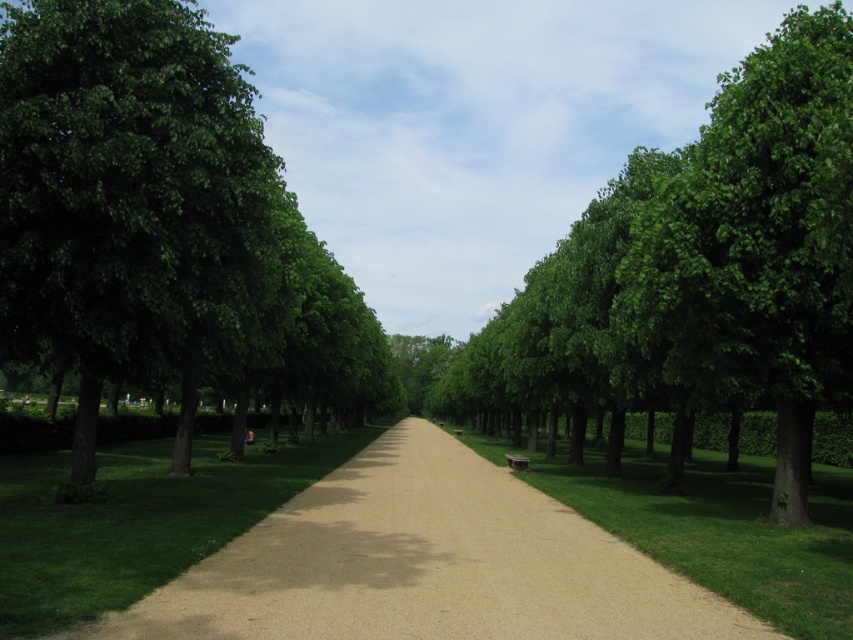
Question: Which object is the closest to the green grass at center?

Choices:
 (A) brown gravel path at center
 (B) green grass at left

Answer: (A)

Question: Can you confirm if green leafy tree at left is positioned to the left of green grass at center?

Choices:
 (A) yes
 (B) no

Answer: (A)

Question: Among these points, which one is nearest to the camera?

Choices:
 (A) (73, 576)
 (B) (236, 300)
 (C) (784, 404)
 (D) (822, 531)

Answer: (A)

Question: Which of the following is the farthest from the observer?

Choices:
 (A) green leafy tree at center
 (B) green grass at center
 (C) green leafy tree at left
 (D) green grass at left

Answer: (C)

Question: Does brown gravel path at center have a lesser width compared to green grass at left?

Choices:
 (A) yes
 (B) no

Answer: (A)

Question: Does green grass at left appear over green grass at center?

Choices:
 (A) yes
 (B) no

Answer: (A)